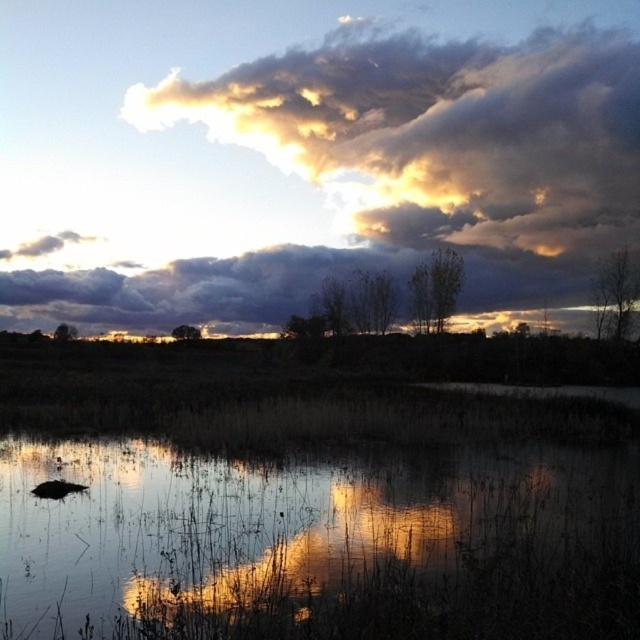
Question: Which point is farther to the camera?

Choices:
 (A) transparent water at center
 (B) cloudy sky at upper center

Answer: (B)

Question: Does transparent water at center have a smaller size compared to cloudy sky at upper center?

Choices:
 (A) yes
 (B) no

Answer: (A)

Question: Which point is farther from the camera taking this photo?

Choices:
 (A) (49, 564)
 (B) (173, 113)

Answer: (B)

Question: Is transparent water at center wider than cloudy sky at upper center?

Choices:
 (A) yes
 (B) no

Answer: (B)

Question: Can you confirm if transparent water at center is thinner than cloudy sky at upper center?

Choices:
 (A) yes
 (B) no

Answer: (A)